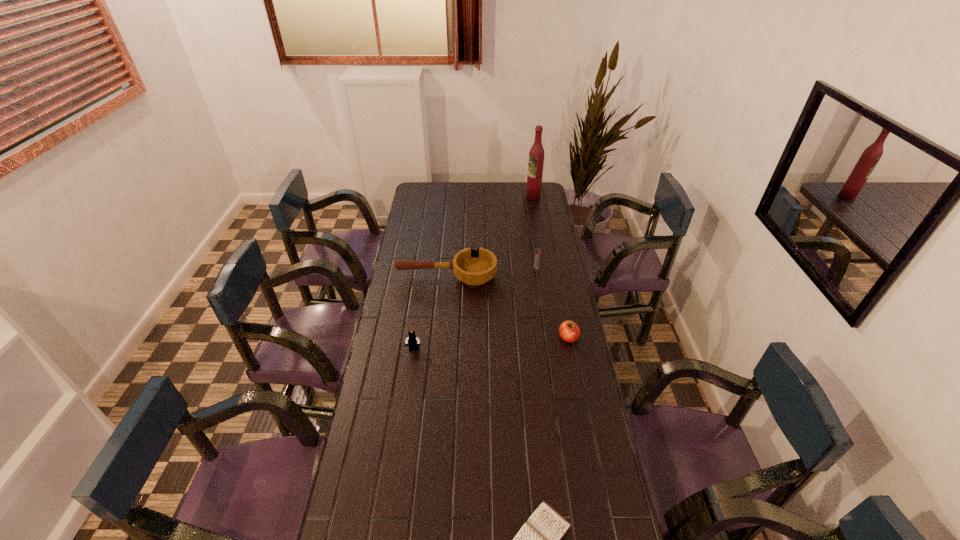
You are a GUI agent. You are given a task and a screenshot of the screen. Output one action in this format:
    pyautogui.click(x=<x>, y=<y>)
    Task: Click on the object that is the closest one to the liquor
    The width and height of the screenshot is (960, 540).
    Given the screenshot: What is the action you would take?
    pyautogui.click(x=537, y=252)

Where is `free space that satisfies the following two spatial constraints: 1. with the handle on the side of the saucepan; 2. on the right side of the igniter`? The width and height of the screenshot is (960, 540). free space that satisfies the following two spatial constraints: 1. with the handle on the side of the saucepan; 2. on the right side of the igniter is located at coordinates (447, 268).

At what (x,y) coordinates should I click in order to perform the action: click on vacant space that satisfies the following two spatial constraints: 1. on the label of the farthest object; 2. on the left side of the apple. Please return your answer as a coordinate pair (x, y). This screenshot has width=960, height=540. Looking at the image, I should click on (558, 338).

Identify the location of vacant space that satisfies the following two spatial constraints: 1. on the label of the liquor; 2. on the front-facing side of the Lego. Image resolution: width=960 pixels, height=540 pixels. (560, 350).